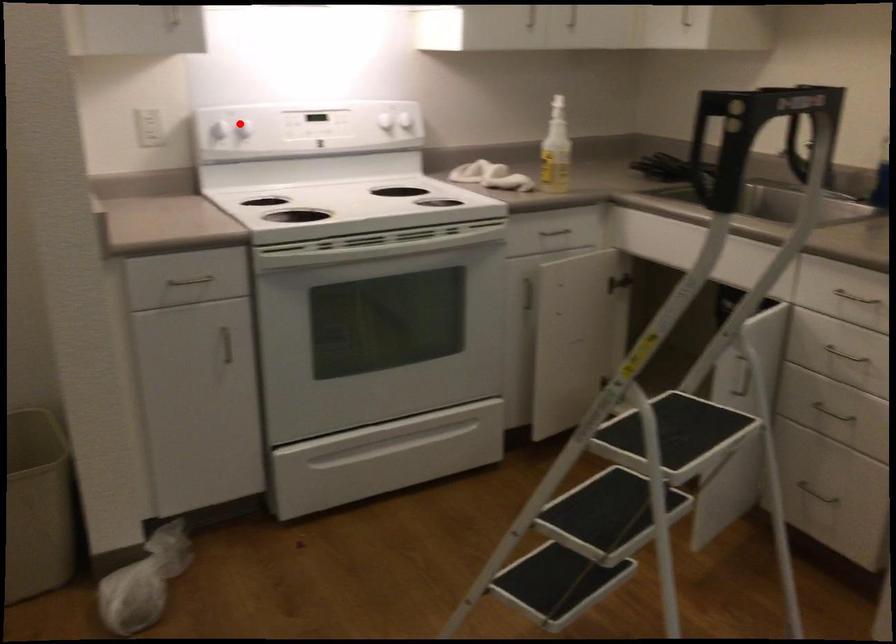
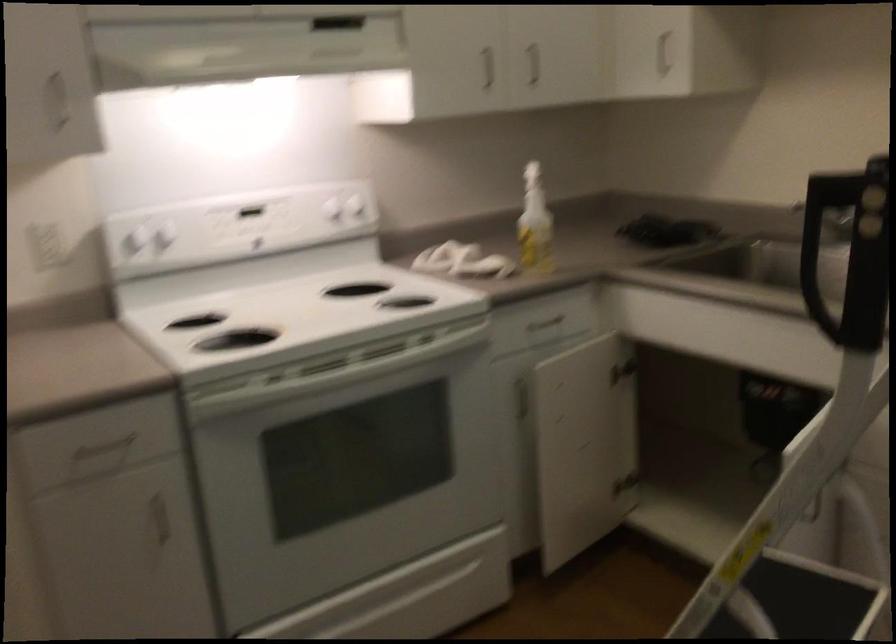
Question: I am providing you with two images of the same scene from different viewpoints. A red point is shown in image1. For the corresponding object point in image2, is it positioned nearer or farther from the camera?

Choices:
 (A) Nearer
 (B) Farther

Answer: (A)